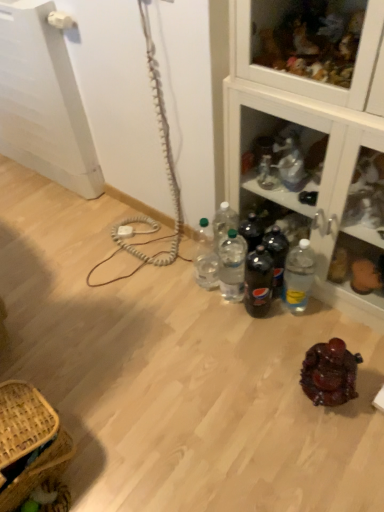
Image resolution: width=384 pixels, height=512 pixels. Find the location of `free point to the right of dark glass bottle at center, the third bottle viewed from the left`. free point to the right of dark glass bottle at center, the third bottle viewed from the left is located at coordinates (307, 317).